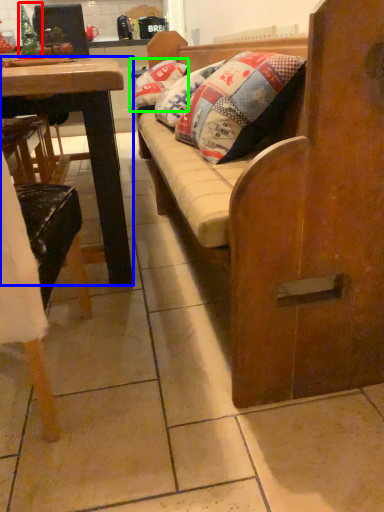
Question: Estimate the real-world distances between objects in this image. Which object is farther from christmas tree (highlighted by a red box), desk (highlighted by a blue box) or pillow (highlighted by a green box)?

Choices:
 (A) desk
 (B) pillow

Answer: (A)